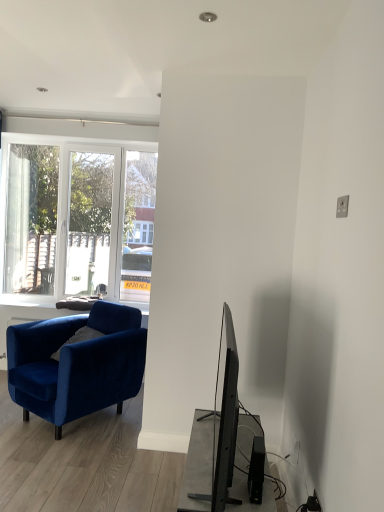
Question: Is velvet blue armchair at left wider or thinner than black plastic speaker at lower right?

Choices:
 (A) thin
 (B) wide

Answer: (B)

Question: From a real-world perspective, is velvet blue armchair at left positioned above or below black plastic speaker at lower right?

Choices:
 (A) above
 (B) below

Answer: (B)

Question: Relative to black plastic speaker at lower right, is velvet blue armchair at left in front or behind?

Choices:
 (A) behind
 (B) front

Answer: (A)

Question: Considering the relative positions of black plastic speaker at lower right and velvet blue armchair at left in the image provided, is black plastic speaker at lower right to the left or to the right of velvet blue armchair at left?

Choices:
 (A) right
 (B) left

Answer: (A)

Question: From their relative heights in the image, would you say black plastic speaker at lower right is taller or shorter than velvet blue armchair at left?

Choices:
 (A) short
 (B) tall

Answer: (A)

Question: Is point (251, 501) closer or farther from the camera than point (122, 379)?

Choices:
 (A) closer
 (B) farther

Answer: (A)

Question: Is black plastic speaker at lower right inside or outside of velvet blue armchair at left?

Choices:
 (A) inside
 (B) outside

Answer: (B)